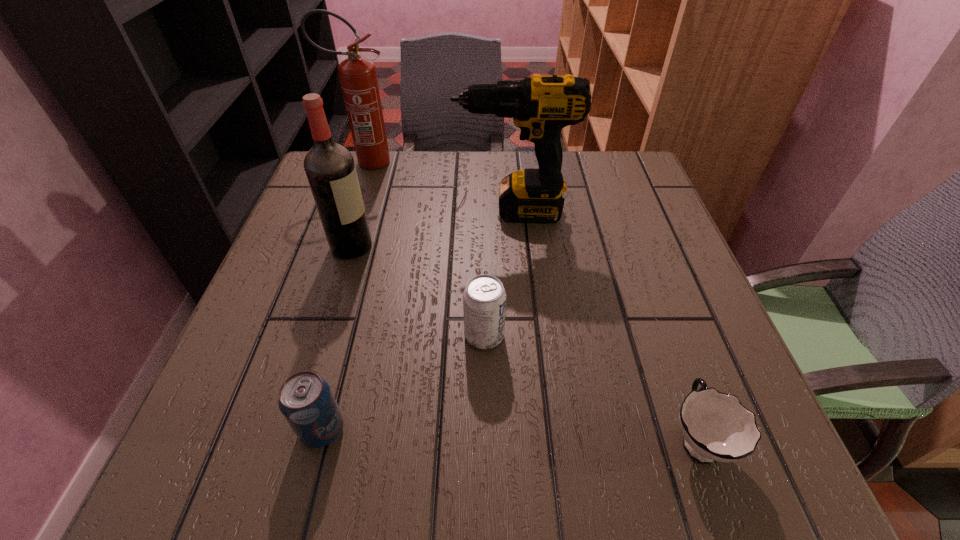
At what (x,y) coordinates should I click in order to perform the action: click on vacant space that satisfies the following two spatial constraints: 1. on the front-facing side of the nearer pop soda; 2. on the left side of the third farthest object. Please return your answer as a coordinate pair (x, y). Image resolution: width=960 pixels, height=540 pixels. Looking at the image, I should click on (297, 429).

Find the location of a particular element. vacant space that satisfies the following two spatial constraints: 1. on the back side of the left pop soda; 2. on the right side of the fourth farthest object is located at coordinates (347, 335).

The width and height of the screenshot is (960, 540). I want to click on free space that satisfies the following two spatial constraints: 1. on the front-facing side of the fourth nearest object; 2. on the right side of the fourth farthest object, so click(325, 335).

What are the coordinates of `free location that satisfies the following two spatial constraints: 1. on the front-facing side of the third farthest object; 2. on the side of the shortest object with the handle` in the screenshot? It's located at (294, 438).

I want to click on vacant space that satisfies the following two spatial constraints: 1. from the nozzle of the nearer pop soda; 2. on the right side of the farthest object, so click(x=276, y=429).

Where is `vacant position in the image that satisfies the following two spatial constraints: 1. at the tip of the drill; 2. on the side of the rightmost object with the handle`? vacant position in the image that satisfies the following two spatial constraints: 1. at the tip of the drill; 2. on the side of the rightmost object with the handle is located at coordinates (532, 438).

Identify the location of vacant space that satisfies the following two spatial constraints: 1. on the back side of the farther pop soda; 2. from the nozzle of the farthest object. The image size is (960, 540). (483, 162).

I want to click on vacant space that satisfies the following two spatial constraints: 1. on the front-facing side of the liquor; 2. on the side of the cup with the handle, so click(x=294, y=438).